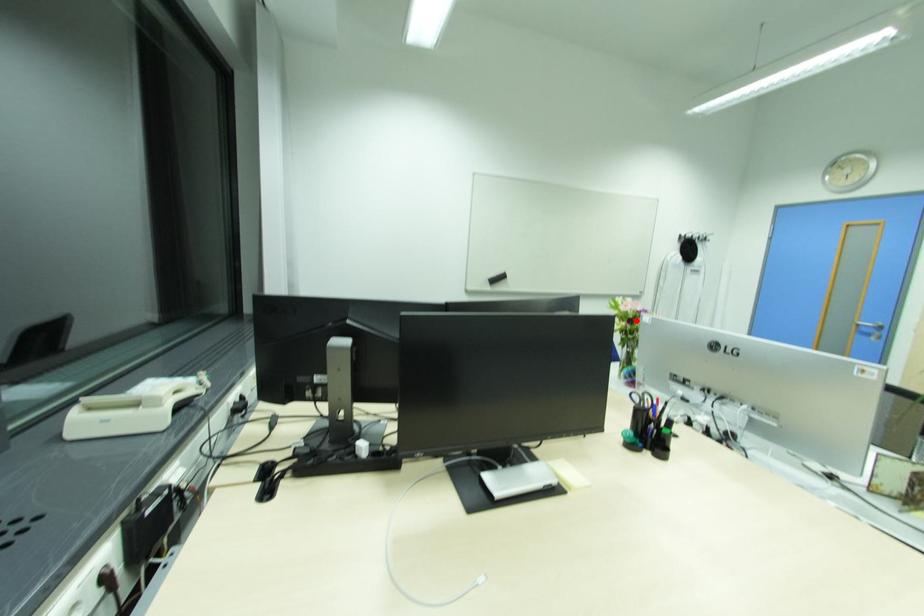
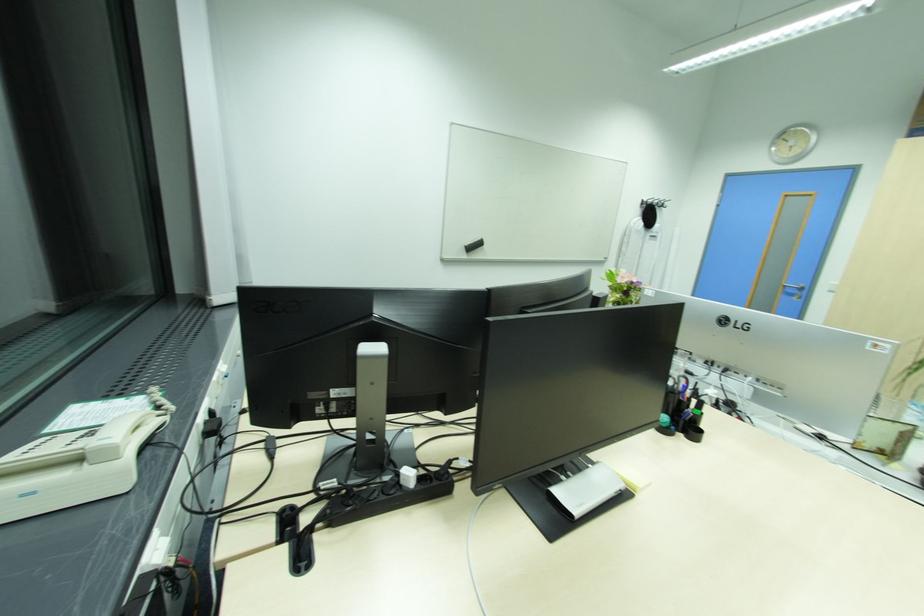
Find the pixel in the second image that matches the highlighted location in the first image.

(630, 293)